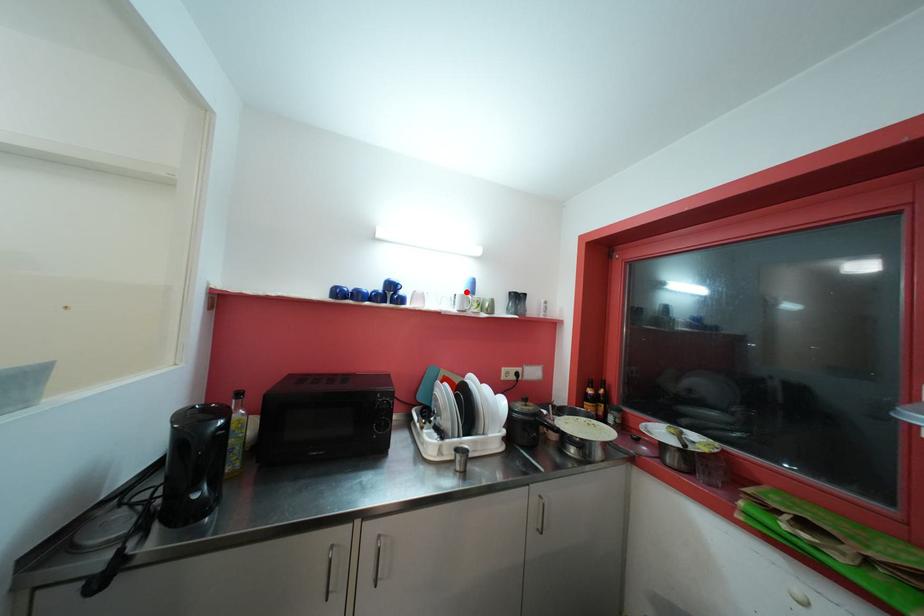
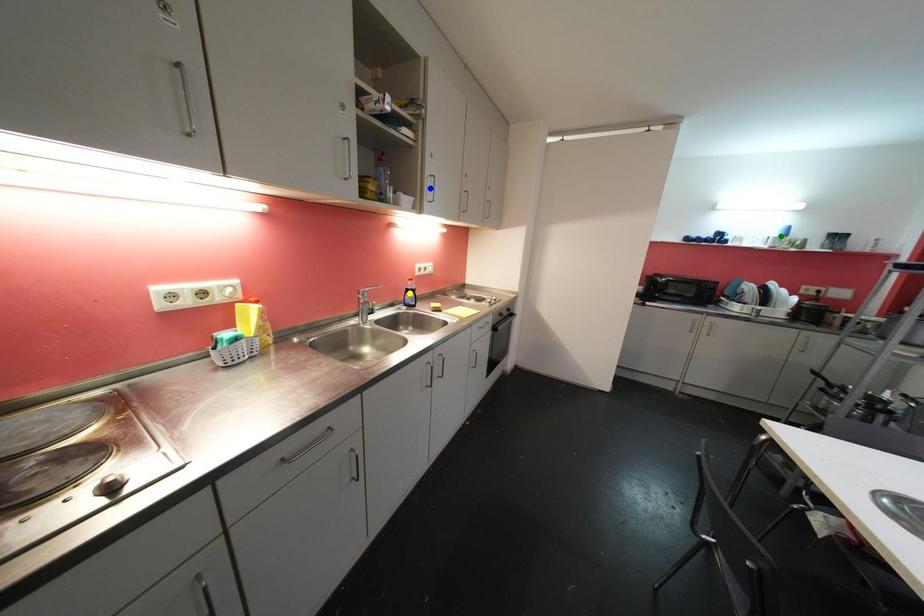
Question: I am providing you with two images of the same scene from different viewpoints. A red point is marked on the first image. You are given multiple points on the second image. Can you choose the point in image 2 that corresponds to the point in image 1?

Choices:
 (A) blue point
 (B) yellow point
 (C) green point

Answer: (C)